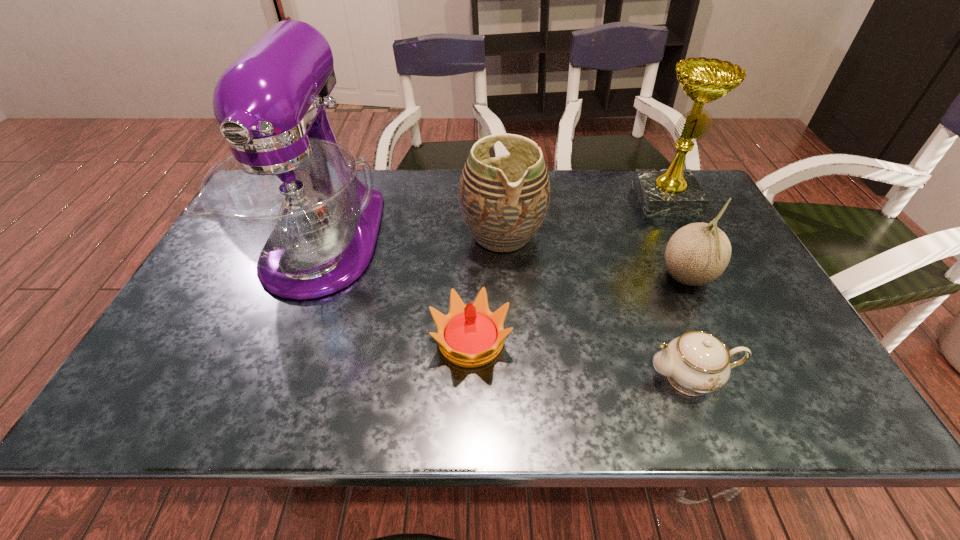
Identify the location of the leftmost object. The height and width of the screenshot is (540, 960). (289, 198).

This screenshot has height=540, width=960. Identify the location of mixer. (289, 198).

This screenshot has width=960, height=540. What are the coordinates of `award` in the screenshot? It's located at (675, 191).

Where is `the third tallest object`? This screenshot has height=540, width=960. the third tallest object is located at coordinates (504, 200).

Where is `cantaloup`? cantaloup is located at coordinates (697, 254).

I want to click on crown, so click(x=470, y=335).

Locate an element on the screen. The height and width of the screenshot is (540, 960). chinaware is located at coordinates (695, 363).

What are the coordinates of `vacant space located 0.050m at the bowl opening of the leftmost object` in the screenshot? It's located at (289, 330).

Identify the location of vacant space located 0.290m on the front-facing side of the award. (710, 287).

Find the location of `vacant area situated on the left of the pottery`. vacant area situated on the left of the pottery is located at coordinates (424, 235).